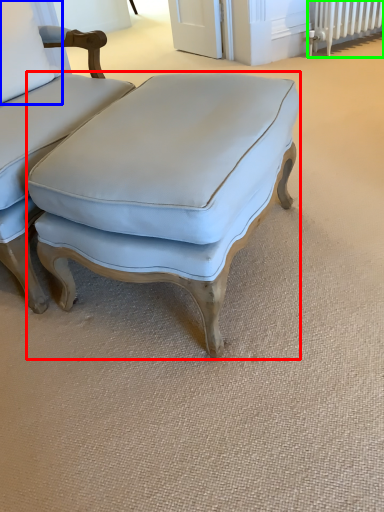
Question: Based on their relative distances, which object is farther from studio couch (highlighted by a red box)? Choose from pillow (highlighted by a blue box) and radiator (highlighted by a green box).

Choices:
 (A) pillow
 (B) radiator

Answer: (B)